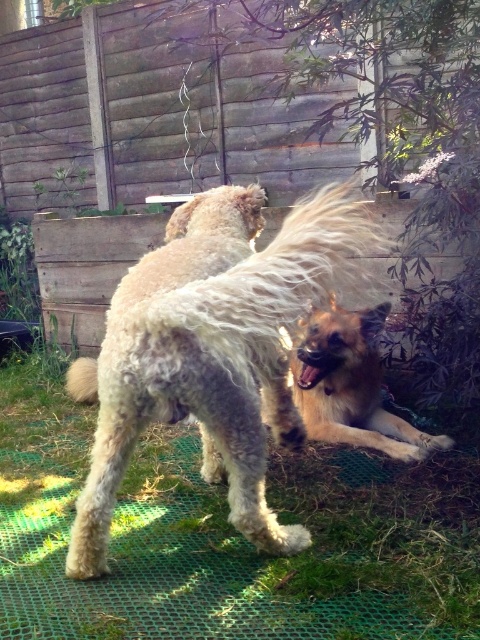
Is point (16, 502) closer to camera compared to point (339, 346)?

Yes, it is in front of point (339, 346).

Can you confirm if green grass at center is positioned to the left of golden brown fur at lower right?

Indeed, green grass at center is positioned on the left side of golden brown fur at lower right.

Which is in front, point (176, 580) or point (335, 394)?

Point (176, 580) is in front.

The image size is (480, 640). What are the coordinates of `green grass at center` in the screenshot? It's located at (226, 540).

Who is lower down, fuzzy beige dog at center or golden brown fur at lower right?

golden brown fur at lower right is lower down.

Does fuzzy beige dog at center come in front of golden brown fur at lower right?

Yes, fuzzy beige dog at center is closer to the viewer.

Describe the element at coordinates (215, 349) in the screenshot. Image resolution: width=480 pixels, height=640 pixels. I see `fuzzy beige dog at center` at that location.

The height and width of the screenshot is (640, 480). I want to click on fuzzy beige dog at center, so click(x=215, y=349).

Which of these two, green grass at center or fuzzy beige dog at center, stands shorter?

green grass at center

Which is behind, point (143, 586) or point (163, 280)?

Positioned behind is point (143, 586).

Is point (14, 568) in front of point (133, 365)?

No.

You are a GUI agent. You are given a task and a screenshot of the screen. Output one action in this format:
    pyautogui.click(x=<x>, y=<y>)
    Task: Click on the green grass at center
    
    Given the screenshot: What is the action you would take?
    pos(226,540)